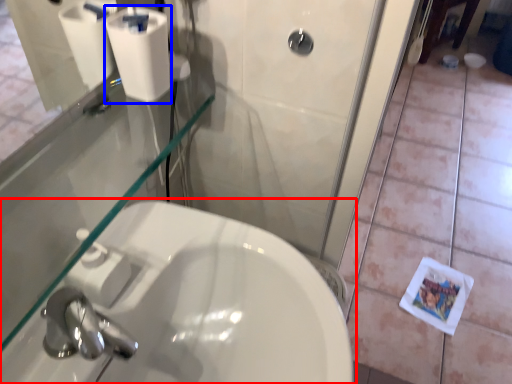
Question: Which point is further to the camera, sink (highlighted by a red box) or toilet paper (highlighted by a blue box)?

Choices:
 (A) sink
 (B) toilet paper

Answer: (B)